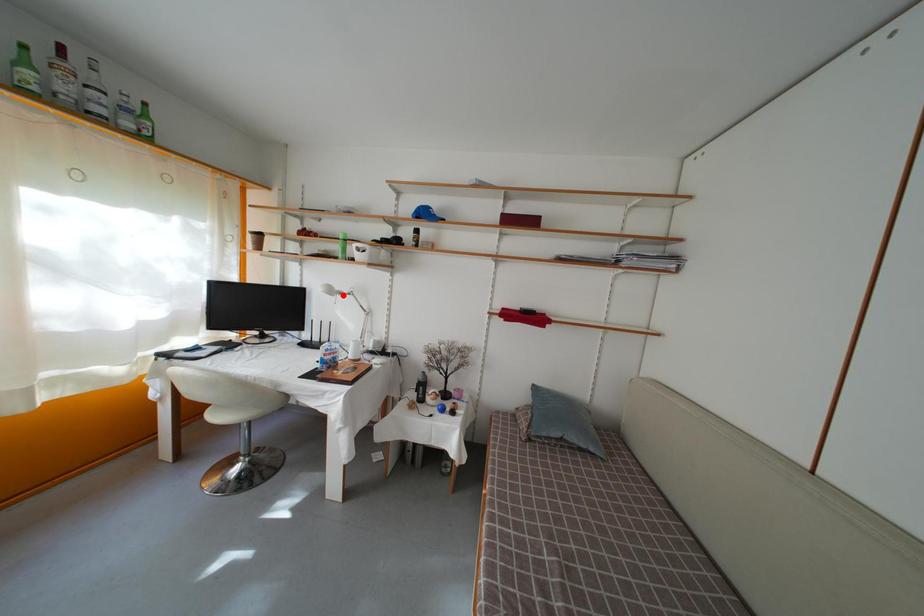
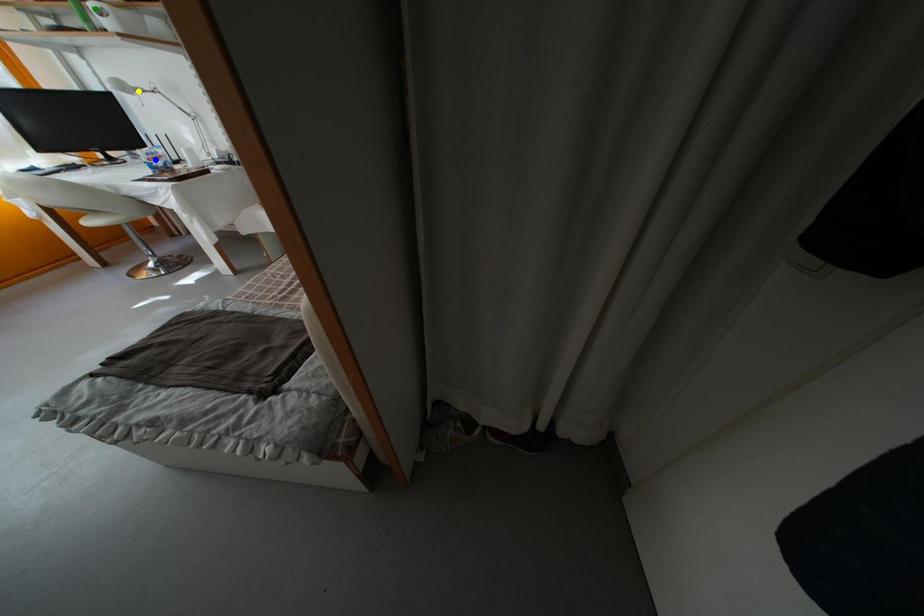
Question: I am providing you with two images of the same scene from different viewpoints. A red point is marked on the first image. You are given multiple points on the second image. Which point in image 2 represents the same 3d spot as the red point in image 1?

Choices:
 (A) yellow point
 (B) blue point
 (C) green point

Answer: (A)